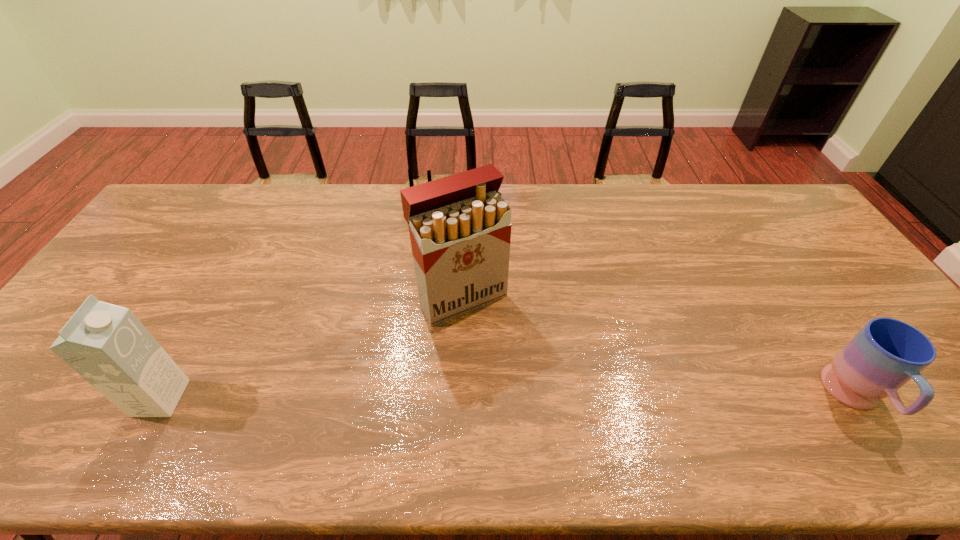
You are a GUI agent. You are given a task and a screenshot of the screen. Output one action in this format:
    pyautogui.click(x=<x>, y=<y>)
    Task: Click on the second closest object relative to the second farthest object
    
    Given the screenshot: What is the action you would take?
    pyautogui.click(x=106, y=344)

Identify which object is located as the second nearest to the third shortest object. Please provide its 2D coordinates. Your answer should be formatted as a tuple, i.e. [(x, y)], where the tuple contains the x and y coordinates of a point satisfying the conditions above.

[(410, 176)]

Find the location of a particular element. Image resolution: width=960 pixels, height=540 pixels. vacant space that satisfies the following two spatial constraints: 1. on the front side of the farthest object; 2. on the right side of the third nearest object is located at coordinates (452, 299).